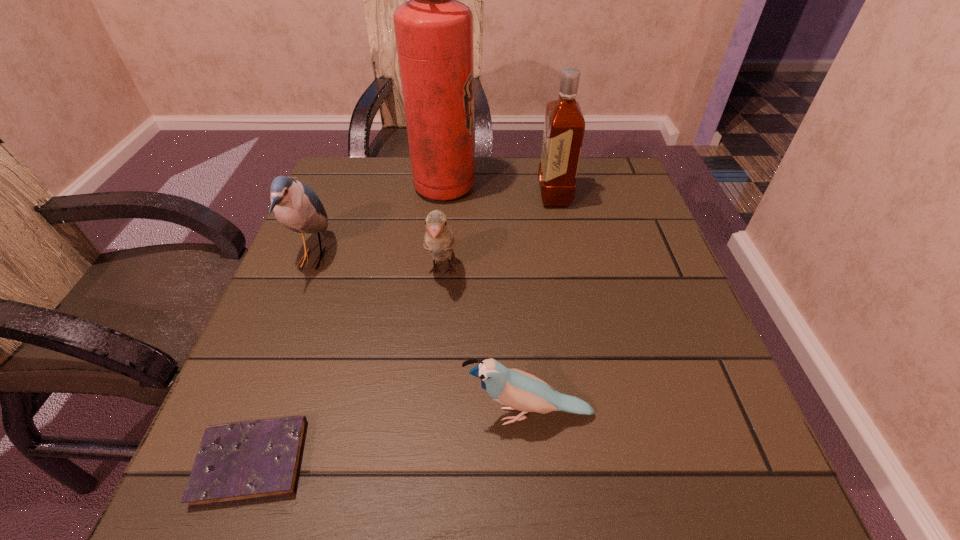
Where is `free location located 0.200m on the front label of the liquor`? free location located 0.200m on the front label of the liquor is located at coordinates (460, 196).

Where is `free space located at the tip of the leftmost bird's beak`? This screenshot has height=540, width=960. free space located at the tip of the leftmost bird's beak is located at coordinates (493, 258).

This screenshot has height=540, width=960. Identify the location of free space located at the face of the second bird from left to right. (433, 372).

Locate an element on the screen. free space located at the face of the nearest bird is located at coordinates (223, 415).

Locate an element on the screen. vacant point located at the face of the nearest bird is located at coordinates (324, 415).

The image size is (960, 540). Find the location of `vacant area located 0.160m at the face of the nearest bird`. vacant area located 0.160m at the face of the nearest bird is located at coordinates (363, 415).

This screenshot has height=540, width=960. Identify the location of vacant space located on the right of the shortest object. (491, 461).

The width and height of the screenshot is (960, 540). I want to click on fire extinguisher situated at the far edge, so (434, 31).

At what (x,y) coordinates should I click in order to perform the action: click on liquor located at the far edge. Please return your answer as a coordinate pair (x, y). This screenshot has height=540, width=960. Looking at the image, I should click on (564, 126).

Locate an element on the screen. The width and height of the screenshot is (960, 540). object that is at the near edge is located at coordinates (244, 461).